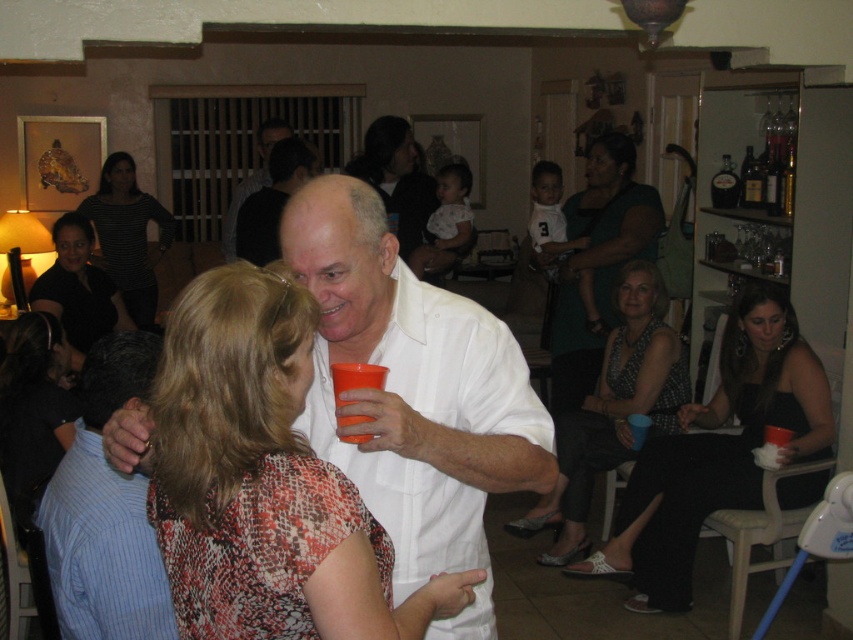
Question: Observing the image, what is the correct spatial positioning of black satin dress at lower right in reference to matte black dress at center?

Choices:
 (A) left
 (B) right

Answer: (B)

Question: Estimate the real-world distances between objects in this image. Which object is closer to the matte green dress at center?

Choices:
 (A) matte black dress at lower left
 (B) matte black dress at center

Answer: (B)

Question: Does black satin dress at lower right appear on the left side of matte green dress at center?

Choices:
 (A) no
 (B) yes

Answer: (A)

Question: Can you confirm if white matte shirt at center is wider than blue striped shirt at center?

Choices:
 (A) no
 (B) yes

Answer: (B)

Question: Estimate the real-world distances between objects in this image. Which object is farther from the blue striped shirt at center?

Choices:
 (A) black satin dress at lower right
 (B) matte green dress at center
 (C) printed fabric dress at center

Answer: (B)

Question: Based on their relative distances, which object is farther from the blue striped shirt at center?

Choices:
 (A) matte green dress at center
 (B) matte black dress at center
 (C) striped shirt at upper left

Answer: (C)